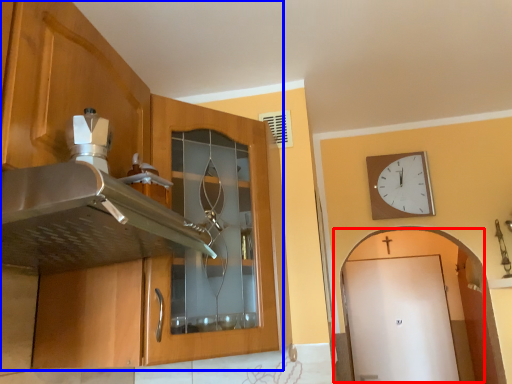
Question: Which object appears farthest to the camera in this image, door (highlighted by a red box) or cabinetry (highlighted by a blue box)?

Choices:
 (A) door
 (B) cabinetry

Answer: (A)